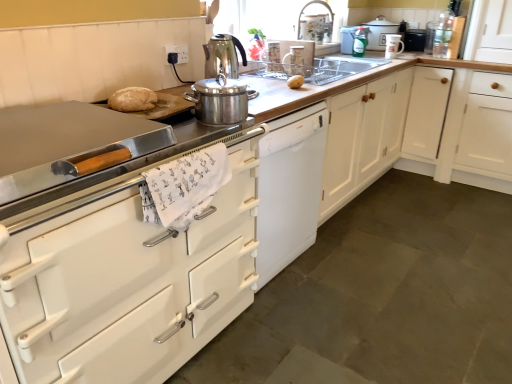
Locate an element on the screen. white ceramic mug at upper right, the fifth kitchen appliance in the left-to-right sequence is located at coordinates (393, 46).

Image resolution: width=512 pixels, height=384 pixels. Describe the element at coordinates (223, 56) in the screenshot. I see `stainless steel kettle at center, acting as the 1th kitchen appliance starting from the left` at that location.

The width and height of the screenshot is (512, 384). Describe the element at coordinates (220, 100) in the screenshot. I see `stainless steel pot at center, the second kitchen appliance positioned from the left` at that location.

The height and width of the screenshot is (384, 512). Describe the element at coordinates (316, 22) in the screenshot. I see `metallic faucet at upper center` at that location.

Locate an element on the screen. This screenshot has width=512, height=384. metallic silver toaster at upper right, placed as the second appliance when sorted from back to front is located at coordinates (430, 36).

What do you see at coordinates (386, 131) in the screenshot? The image size is (512, 384). I see `white wood cabinet at right, which is the 1th cabinetry from back to front` at bounding box center [386, 131].

Identify the location of white ceramic mug at upper right, the fifth kitchen appliance in the left-to-right sequence. The width and height of the screenshot is (512, 384). (393, 46).

Does green glossy spray bottle at upper center, arranged as the fourth kitchen appliance when viewed from the left, have a lesser width compared to metallic silver toaster at upper right, placed as the second appliance when sorted from back to front?

Yes, green glossy spray bottle at upper center, arranged as the fourth kitchen appliance when viewed from the left, is thinner than metallic silver toaster at upper right, placed as the second appliance when sorted from back to front.

Does green glossy spray bottle at upper center, the third kitchen appliance from the right, turn towards metallic silver toaster at upper right, placed as the second appliance when sorted from back to front?

No, green glossy spray bottle at upper center, the third kitchen appliance from the right, is not oriented towards metallic silver toaster at upper right, placed as the second appliance when sorted from back to front.

Is metallic silver toaster at upper right, which ranks as the 1th appliance in front-to-back order, inside green glossy spray bottle at upper center, the fifth kitchen appliance viewed from the front?

No, metallic silver toaster at upper right, which ranks as the 1th appliance in front-to-back order, is not surrounded by green glossy spray bottle at upper center, the fifth kitchen appliance viewed from the front.

Can you confirm if green glossy spray bottle at upper center, which appears as the 2th kitchen appliance when viewed from the back, is shorter than metallic silver toaster at upper right, placed as the second appliance when sorted from back to front?

Yes.

Is yellow matte potato at center surrounded by black matte microwave at upper right, the first appliance positioned from the back?

No, yellow matte potato at center is not inside black matte microwave at upper right, the first appliance positioned from the back.

Can you confirm if black matte microwave at upper right, the first appliance positioned from the back, is taller than yellow matte potato at center?

Yes.

Can you confirm if black matte microwave at upper right, the first appliance positioned from the back, is positioned to the left of yellow matte potato at center?

In fact, black matte microwave at upper right, the first appliance positioned from the back, is to the right of yellow matte potato at center.

Is point (417, 39) positioned before point (323, 15)?

No, (417, 39) is further to viewer.

Considering the positions of objects black matte microwave at upper right, marked as the 2th appliance in a front-to-back arrangement, and metallic faucet at upper center in the image provided, who is more to the right, black matte microwave at upper right, marked as the 2th appliance in a front-to-back arrangement, or metallic faucet at upper center?

black matte microwave at upper right, marked as the 2th appliance in a front-to-back arrangement, is more to the right.

Can you confirm if black matte microwave at upper right, the first appliance positioned from the back, is wider than metallic faucet at upper center?

Incorrect, the width of black matte microwave at upper right, the first appliance positioned from the back, does not surpass that of metallic faucet at upper center.

Is point (445, 123) in front of point (365, 37)?

Yes, point (445, 123) is in front of point (365, 37).

Is white wood cabinet at right, which ranks as the 2th cabinetry in left-to-right order, bigger or smaller than green glossy spray bottle at upper center, the fifth kitchen appliance viewed from the front?

In the image, white wood cabinet at right, which ranks as the 2th cabinetry in left-to-right order, appears to be larger than green glossy spray bottle at upper center, the fifth kitchen appliance viewed from the front.

Is white wood cabinet at right, which appears as the 2th cabinetry when viewed from the front, not within green glossy spray bottle at upper center, arranged as the fourth kitchen appliance when viewed from the left?

Indeed, white wood cabinet at right, which appears as the 2th cabinetry when viewed from the front, is completely outside green glossy spray bottle at upper center, arranged as the fourth kitchen appliance when viewed from the left.

Identify the location of cabinetry that appears on the right of green glossy spray bottle at upper center, the third kitchen appliance from the right. (386, 131).

Are white ceramic mug at upper right, the 3th kitchen appliance from the back, and yellow matte potato at center far apart?

Absolutely, white ceramic mug at upper right, the 3th kitchen appliance from the back, is distant from yellow matte potato at center.

Is yellow matte potato at center located within white ceramic mug at upper right, the 3th kitchen appliance from the back?

No, yellow matte potato at center is not a part of white ceramic mug at upper right, the 3th kitchen appliance from the back.

Based on their sizes in the image, would you say white ceramic mug at upper right, acting as the fourth kitchen appliance starting from the front, is bigger or smaller than yellow matte potato at center?

Considering their sizes, white ceramic mug at upper right, acting as the fourth kitchen appliance starting from the front, takes up more space than yellow matte potato at center.

Is white ceramic mug at upper right, acting as the fourth kitchen appliance starting from the front, to the left or to the right of yellow matte potato at center in the image?

white ceramic mug at upper right, acting as the fourth kitchen appliance starting from the front, is to the right of yellow matte potato at center.

Which object is positioned more to the left, white glossy cabinet at left, which appears as the 1th cabinetry when ordered from the bottom, or clear glass sink at center?

Positioned to the left is white glossy cabinet at left, which appears as the 1th cabinetry when ordered from the bottom.

Locate an element on the screen. This screenshot has height=384, width=512. sink above the white glossy cabinet at left, acting as the 2th cabinetry starting from the right (from a real-world perspective) is located at coordinates (315, 69).

Does white glossy cabinet at left, acting as the 2th cabinetry starting from the right, contain clear glass sink at center?

No, clear glass sink at center is not a part of white glossy cabinet at left, acting as the 2th cabinetry starting from the right.

Considering the relative sizes of white glossy cabinet at left, which appears as the 1th cabinetry when ordered from the bottom, and clear glass sink at center in the image provided, is white glossy cabinet at left, which appears as the 1th cabinetry when ordered from the bottom, wider than clear glass sink at center?

Yes.

Which object is thinner, white glossy cabinet at left, acting as the 2th cabinetry starting from the right, or black matte microwave at upper right, the first appliance positioned from the back?

Thinner between the two is black matte microwave at upper right, the first appliance positioned from the back.

From the image's perspective, which one is positioned higher, white glossy cabinet at left, the second cabinetry from the top, or black matte microwave at upper right, the first appliance positioned from the back?

black matte microwave at upper right, the first appliance positioned from the back, from the image's perspective.

Does white glossy cabinet at left, acting as the 2th cabinetry starting from the right, have a larger size compared to black matte microwave at upper right, the first appliance positioned from the back?

Yes.

Locate an element on the screen. The height and width of the screenshot is (384, 512). appliance that is above the green glossy spray bottle at upper center, arranged as the fourth kitchen appliance when viewed from the left (from a real-world perspective) is located at coordinates (430, 36).

The height and width of the screenshot is (384, 512). I want to click on food below the black matte microwave at upper right, the first appliance positioned from the back (from the image's perspective), so click(x=295, y=81).

From the image, which object appears to be nearer to stainless steel kettle at center, acting as the 1th kitchen appliance starting from the left, metallic silver toaster at upper right, which ranks as the 1th appliance in front-to-back order, or white ceramic crock pot at upper center, positioned as the first kitchen appliance in back-to-front order?

white ceramic crock pot at upper center, positioned as the first kitchen appliance in back-to-front order, lies closer to stainless steel kettle at center, acting as the 1th kitchen appliance starting from the left, than the other object.

Which object lies further to the anchor point metallic faucet at upper center, stainless steel pot at center, which ranks as the 1th kitchen appliance in front-to-back order, or white glossy cabinet at left, acting as the 2th cabinetry starting from the right?

white glossy cabinet at left, acting as the 2th cabinetry starting from the right.

Which object lies further to the anchor point white ceramic mug at upper right, the fifth kitchen appliance in the left-to-right sequence, clear glass sink at center or white glossy cabinet at left, the second cabinetry in the back-to-front sequence?

Based on the image, white glossy cabinet at left, the second cabinetry in the back-to-front sequence, appears to be further to white ceramic mug at upper right, the fifth kitchen appliance in the left-to-right sequence.

Considering their positions, is metallic faucet at upper center positioned further to metallic silver toaster at upper right, placed as the second appliance when sorted from back to front, than black matte microwave at upper right, the first appliance positioned from the back?

metallic faucet at upper center lies further to metallic silver toaster at upper right, placed as the second appliance when sorted from back to front, than the other object.

Estimate the real-world distances between objects in this image. Which object is further from white ceramic crock pot at upper center, the 1th kitchen appliance in the right-to-left sequence, metallic silver toaster at upper right, placed as the second appliance when sorted from back to front, or white glossy cabinet at left, which appears as the 1th cabinetry when ordered from the bottom?

white glossy cabinet at left, which appears as the 1th cabinetry when ordered from the bottom, lies further to white ceramic crock pot at upper center, the 1th kitchen appliance in the right-to-left sequence, than the other object.

Based on their spatial positions, is white glossy cabinet at left, which appears as the 1th cabinetry when ordered from the bottom, or white ceramic crock pot at upper center, the sixth kitchen appliance viewed from the left, closer to clear glass pitcher at upper center, the 3th kitchen appliance when ordered from left to right?

Among the two, white ceramic crock pot at upper center, the sixth kitchen appliance viewed from the left, is located nearer to clear glass pitcher at upper center, the 3th kitchen appliance when ordered from left to right.

Which object lies nearer to the anchor point green glossy spray bottle at upper center, arranged as the fourth kitchen appliance when viewed from the left, white wood cabinet at right, positioned as the 2th cabinetry in bottom-to-top order, or white ceramic crock pot at upper center, the sixth kitchen appliance viewed from the left?

white ceramic crock pot at upper center, the sixth kitchen appliance viewed from the left, is positioned closer to the anchor green glossy spray bottle at upper center, arranged as the fourth kitchen appliance when viewed from the left.

From the image, which object appears to be nearer to yellow matte potato at center, clear glass sink at center or white glossy cabinet at left, which appears as the 1th cabinetry when ordered from the bottom?

The object closer to yellow matte potato at center is clear glass sink at center.

Locate an element on the screen. Image resolution: width=512 pixels, height=384 pixels. faucet between yellow matte potato at center and white wood cabinet at right, which appears as the 2th cabinetry when viewed from the front, from left to right is located at coordinates (316, 22).

You are a GUI agent. You are given a task and a screenshot of the screen. Output one action in this format:
    pyautogui.click(x=<x>, y=<y>)
    Task: Click on the cabinetry between stainless steel kettle at center, acting as the 1th kitchen appliance starting from the left, and white ceramic crock pot at upper center, which is the 6th kitchen appliance from front to back, along the z-axis
    
    Given the screenshot: What is the action you would take?
    pyautogui.click(x=386, y=131)

This screenshot has width=512, height=384. Identify the location of cabinetry positioned between white glossy cabinet at left, acting as the 2th cabinetry starting from the right, and white ceramic crock pot at upper center, the sixth kitchen appliance viewed from the left, from near to far. (386, 131).

Where is `cabinetry between white glossy cabinet at left, which appears as the 1th cabinetry when ordered from the bottom, and black matte microwave at upper right, marked as the 2th appliance in a front-to-back arrangement, from front to back`? Image resolution: width=512 pixels, height=384 pixels. cabinetry between white glossy cabinet at left, which appears as the 1th cabinetry when ordered from the bottom, and black matte microwave at upper right, marked as the 2th appliance in a front-to-back arrangement, from front to back is located at coordinates (386, 131).